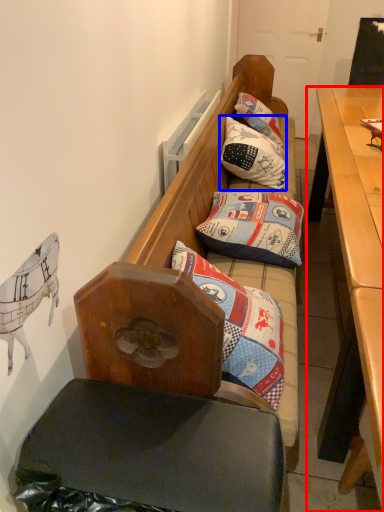
Question: Which object is closer to the camera taking this photo, desk (highlighted by a red box) or pillow (highlighted by a blue box)?

Choices:
 (A) desk
 (B) pillow

Answer: (A)